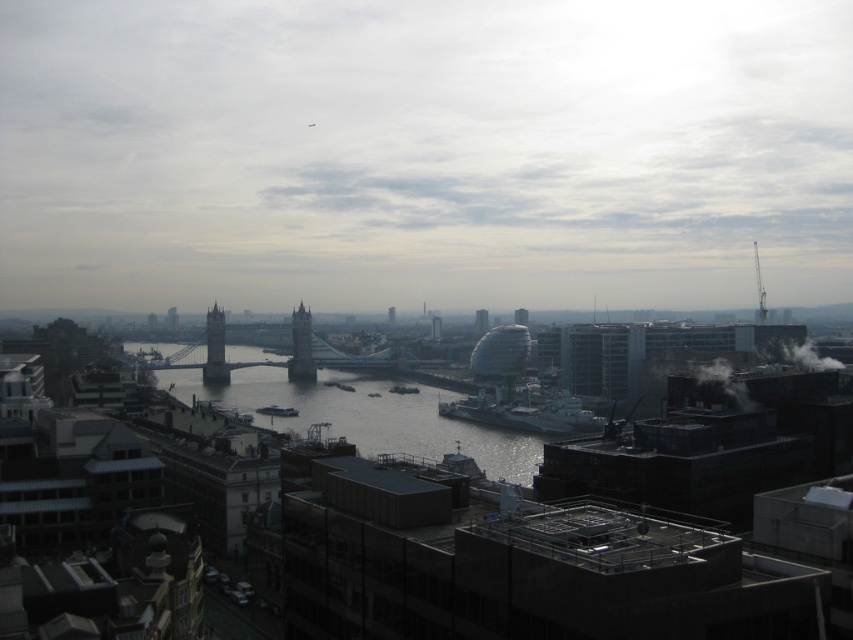
You are standing at the viewpoint overlooking the city and want to take a photo. There are two points of interest marked as point 1 at coordinates (519, 461) and point 2 at coordinates (306, 337). Which point will appear larger in your photo?

Point 1 at coordinates (519, 461) will appear larger in the photo because it is closer to the camera than point 2 at coordinates (306, 337).

You are standing at the vantage point overlooking the cityscape. You notice a dark gray concrete river at center. Based on its coordinates, can you determine its position relative to the Tower Bridge?

The dark gray concrete river at center is located at coordinates point (368, 416), which places it in the central part of the image, directly below Tower Bridge, spanning the river.